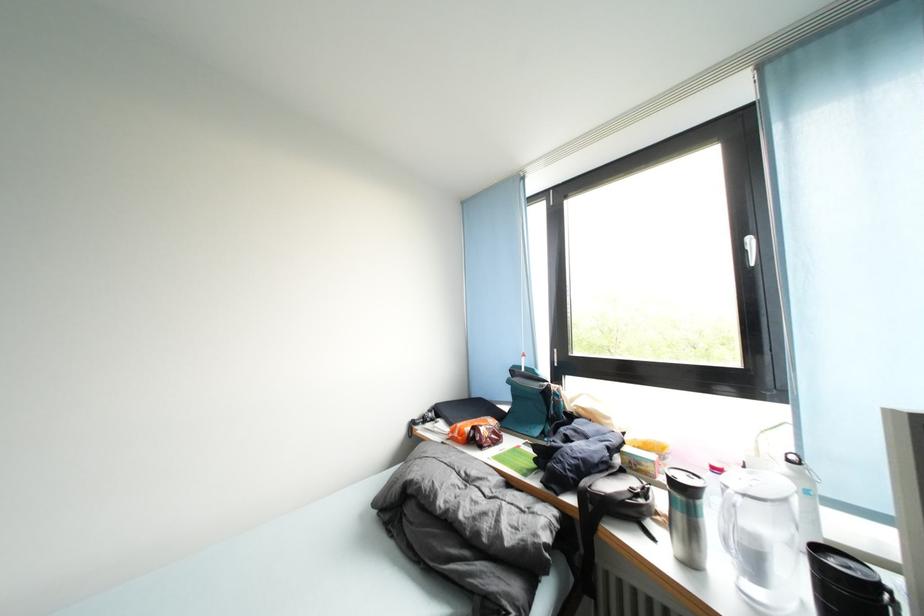
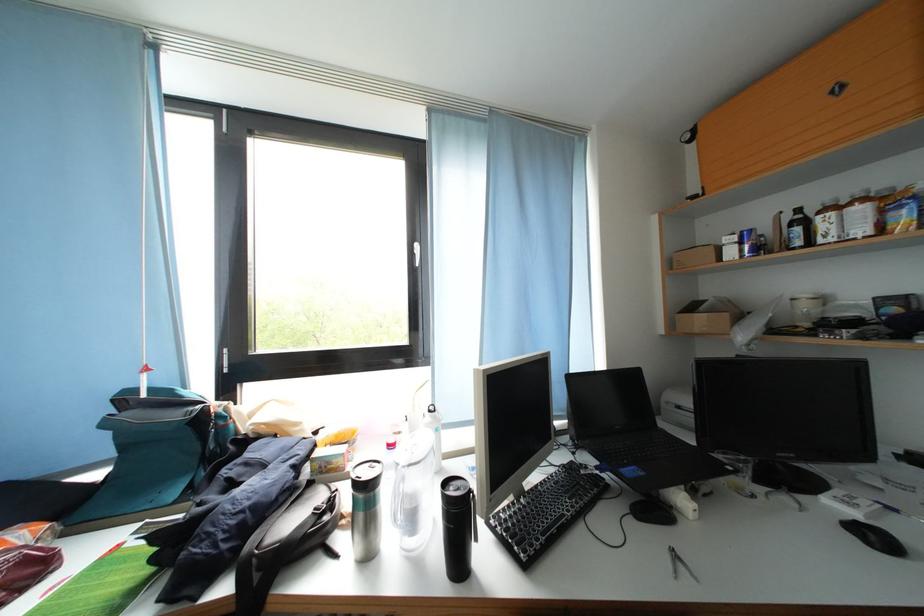
The point at (687, 522) is marked in the first image. Where is the corresponding point in the second image?

(369, 521)